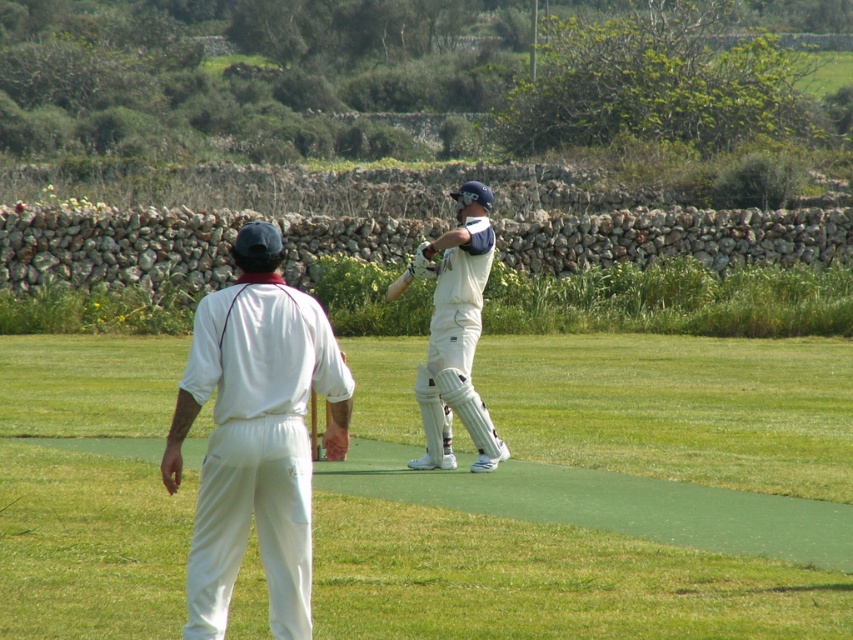
Question: Does white fabric cricket uniform at center have a smaller size compared to white matte cricket bat at center?

Choices:
 (A) no
 (B) yes

Answer: (B)

Question: Which point is farther to the camera?

Choices:
 (A) white matte cricket bat at center
 (B) white fabric cricket uniform at center

Answer: (A)

Question: Does white fabric cricket uniform at center have a lesser width compared to white matte cricket bat at center?

Choices:
 (A) yes
 (B) no

Answer: (A)

Question: Which of the following is the closest to the observer?

Choices:
 (A) (465, 385)
 (B) (285, 570)

Answer: (B)

Question: Can you confirm if white fabric cricket uniform at center is positioned to the right of white matte cricket bat at center?

Choices:
 (A) yes
 (B) no

Answer: (B)